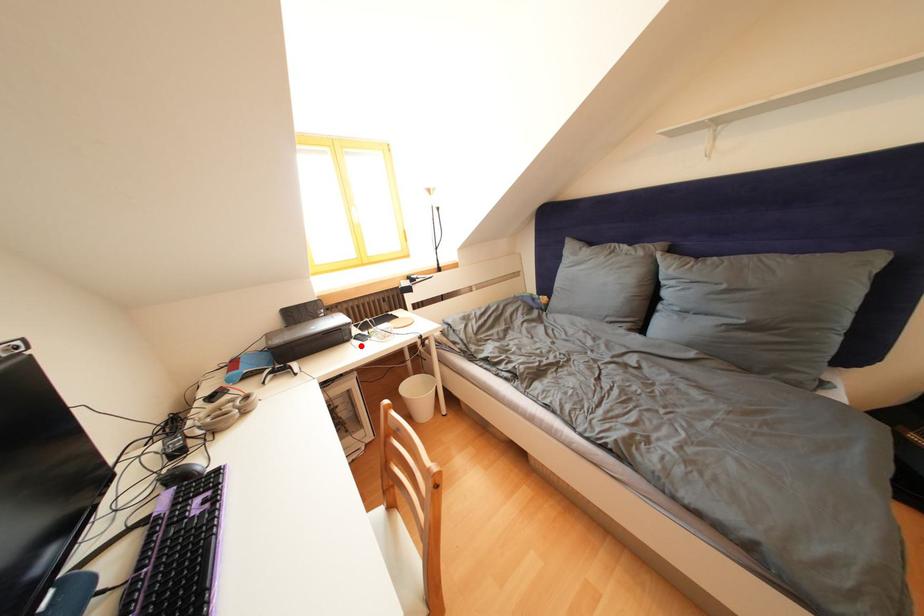
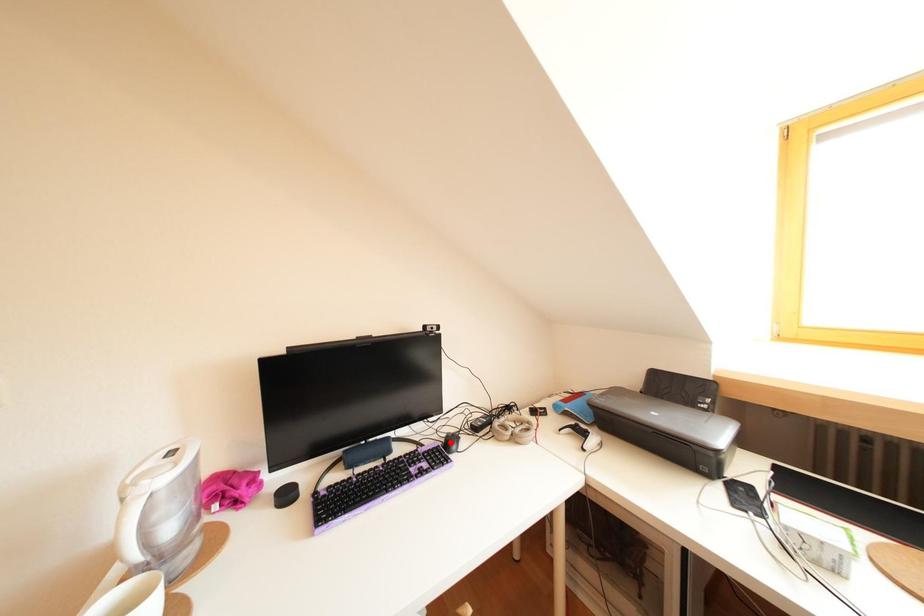
I am providing you with two images of the same scene from different viewpoints. A red point is marked on the first image and another point is marked on the second image. Is the red point in image1 aligned with the point shown in image2?

No